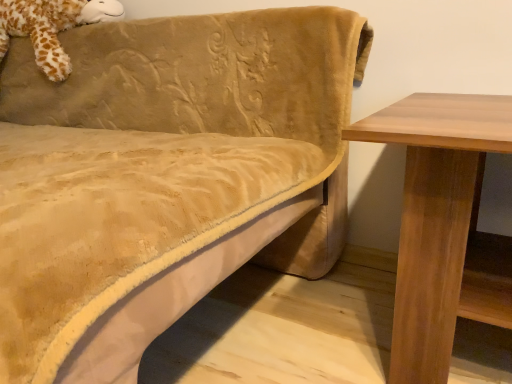
Question: From a real-world perspective, relative to fluffy brown giraffe at upper left, is velvet beige couch at upper left vertically above or below?

Choices:
 (A) below
 (B) above

Answer: (A)

Question: From their relative heights in the image, would you say velvet beige couch at upper left is taller or shorter than fluffy brown giraffe at upper left?

Choices:
 (A) tall
 (B) short

Answer: (A)

Question: Based on their positions, is velvet beige couch at upper left located to the left or right of fluffy brown giraffe at upper left?

Choices:
 (A) right
 (B) left

Answer: (A)

Question: In terms of height, does fluffy brown giraffe at upper left look taller or shorter compared to velvet beige couch at upper left?

Choices:
 (A) tall
 (B) short

Answer: (B)

Question: Is fluffy brown giraffe at upper left wider or thinner than velvet beige couch at upper left?

Choices:
 (A) thin
 (B) wide

Answer: (A)

Question: Is fluffy brown giraffe at upper left in front of or behind velvet beige couch at upper left in the image?

Choices:
 (A) behind
 (B) front

Answer: (A)

Question: From the image's perspective, is fluffy brown giraffe at upper left positioned above or below velvet beige couch at upper left?

Choices:
 (A) above
 (B) below

Answer: (A)